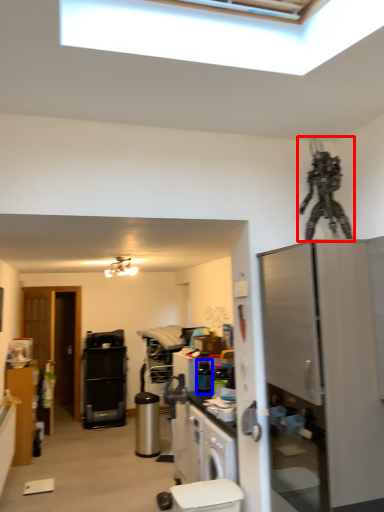
Question: Which point is closer to the camera, toy (highlighted by a red box) or appliance (highlighted by a blue box)?

Choices:
 (A) toy
 (B) appliance

Answer: (A)